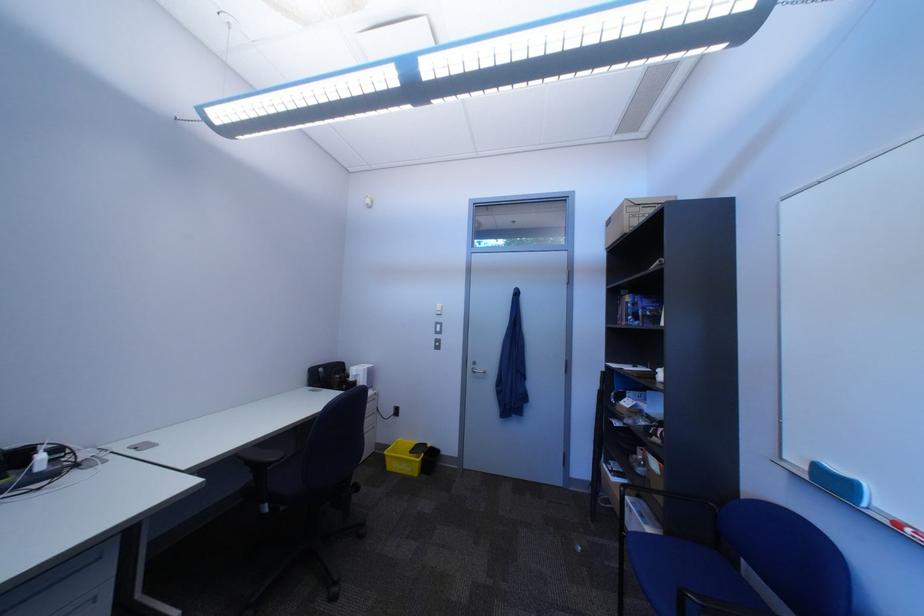
Describe the element at coordinates (260, 469) in the screenshot. I see `the black chair sitting surface` at that location.